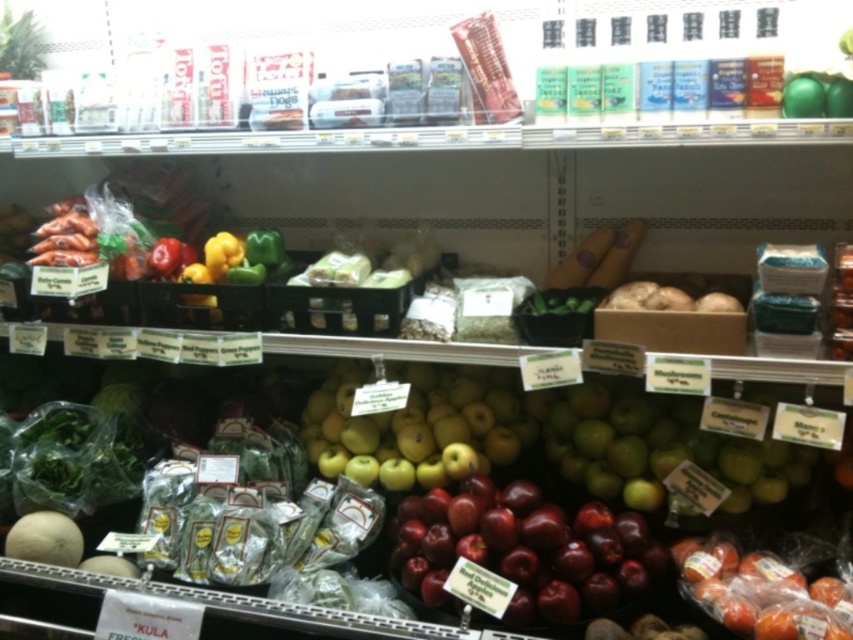
Question: Which point appears closest to the camera in this image?

Choices:
 (A) (553, 570)
 (B) (834, 106)

Answer: (B)

Question: Estimate the real-world distances between objects in this image. Which object is closer to the green matte apples at center?

Choices:
 (A) shiny red apples at lower right
 (B) green leafy vegetable at upper left
 (C) green glossy apple at upper right
 (D) shiny red apples at center

Answer: (A)

Question: Considering the relative positions of green matte apples at center and green glossy apple at upper right in the image provided, where is green matte apples at center located with respect to green glossy apple at upper right?

Choices:
 (A) below
 (B) above

Answer: (A)

Question: Considering the relative positions of yellow matte apples at center and green glossy apple at upper right in the image provided, where is yellow matte apples at center located with respect to green glossy apple at upper right?

Choices:
 (A) below
 (B) above

Answer: (A)

Question: Among these points, which one is nearest to the camera?

Choices:
 (A) (30, 13)
 (B) (587, 561)
 (C) (688, 573)
 (D) (846, 104)

Answer: (D)

Question: Is shiny red apples at center in front of shiny red apples at lower right?

Choices:
 (A) yes
 (B) no

Answer: (B)